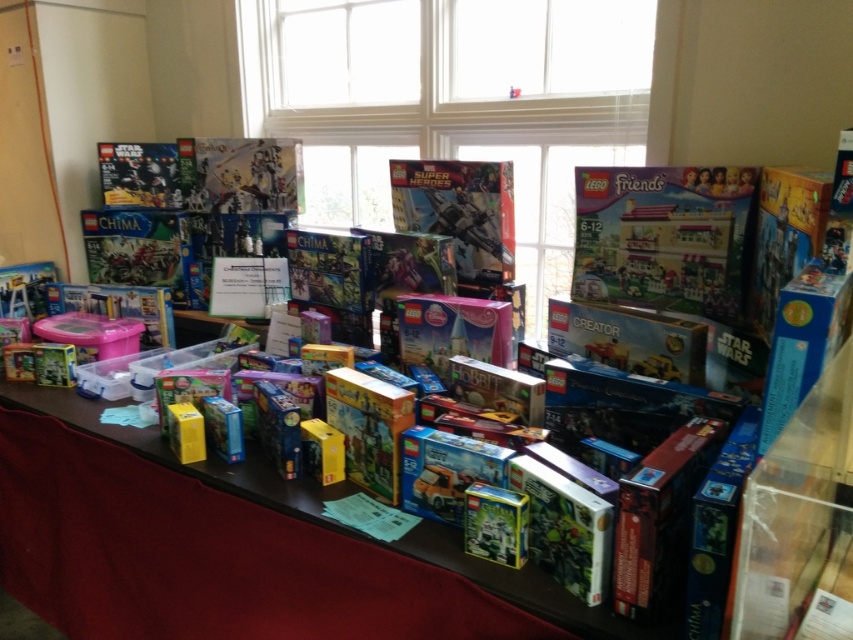
Consider the image. You are looking at the table with LEGO sets. There are two points marked on the table surface at coordinates point (703, 241) and point (608, 348). Which point is closer to you?

Point (703, 241) is closer to the camera than point (608, 348), so the point closer to you is point (703, 241).